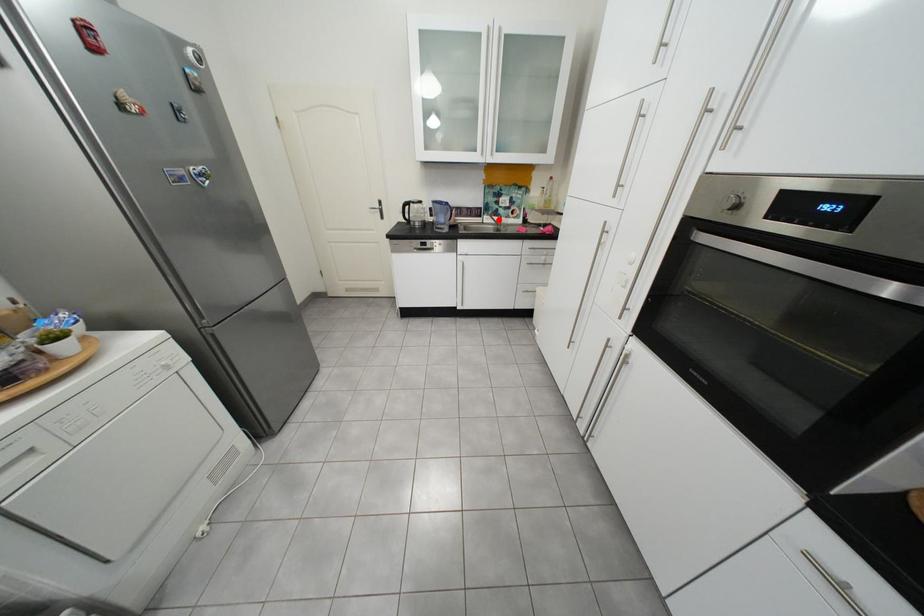
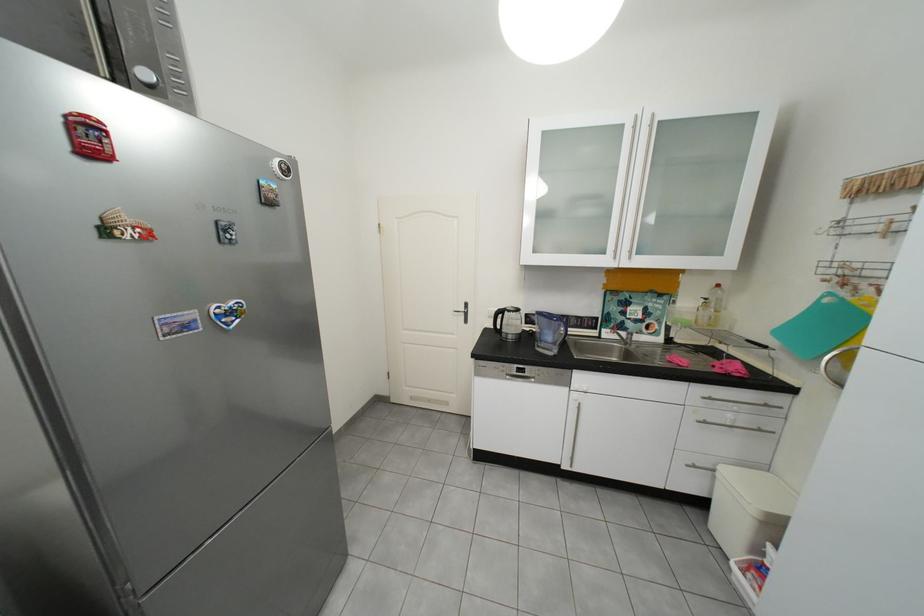
Locate, in the second image, the point that corresponds to the highlighted location in the first image.

(619, 334)